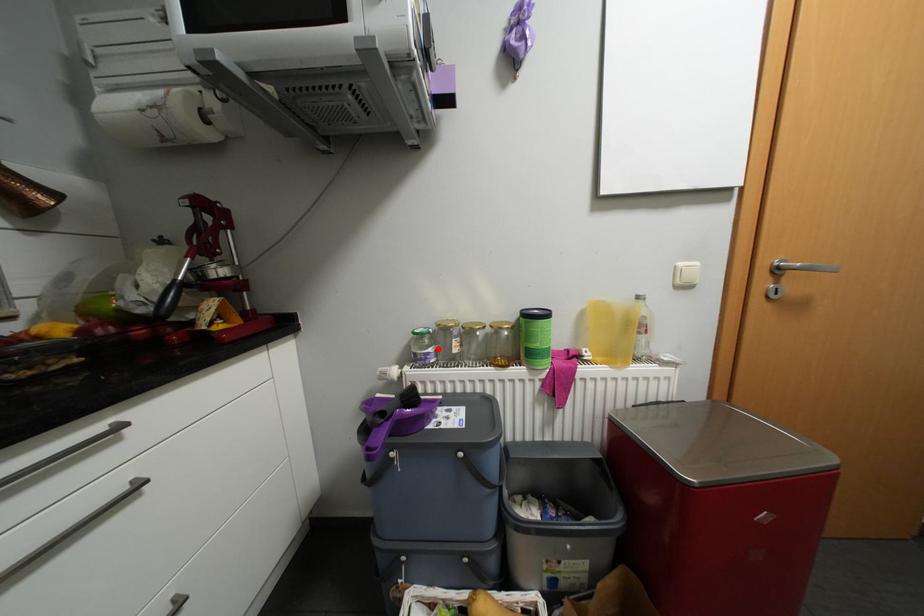
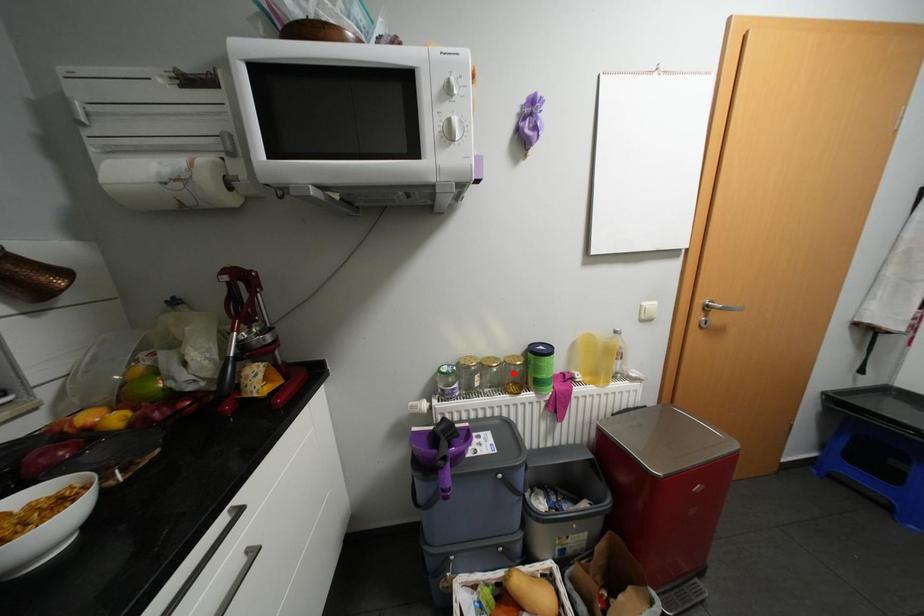
I am providing you with two images of the same scene from different viewpoints. A red point is marked on the first image and another point is marked on the second image. Do the highlighted points in image1 and image2 indicate the same real-world spot?

No